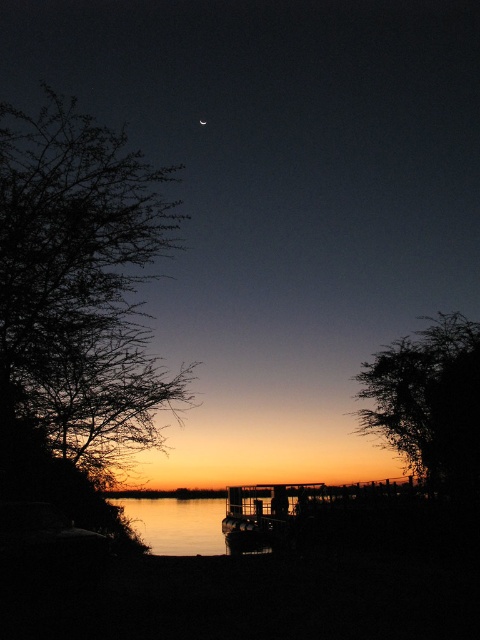
Question: Which point is farther to the camera?

Choices:
 (A) (151, 550)
 (B) (435, 376)
 (C) (407, 486)

Answer: (A)

Question: Which point is farther to the camera?

Choices:
 (A) bright silver moon at upper center
 (B) silhouette wooden dock at center

Answer: (A)

Question: Can you confirm if silhouette leafy tree at right is positioned to the left of silhouette wooden dock at center?

Choices:
 (A) yes
 (B) no

Answer: (B)

Question: Is silhouette leafy tree at right smaller than bright silver moon at upper center?

Choices:
 (A) no
 (B) yes

Answer: (A)

Question: In this image, where is silhouette leafy tree at left located relative to silky water at center?

Choices:
 (A) right
 (B) left

Answer: (B)

Question: Which object is the farthest from the silhouette leafy tree at left?

Choices:
 (A) silhouette leafy tree at right
 (B) bright silver moon at upper center
 (C) silky water at center

Answer: (B)